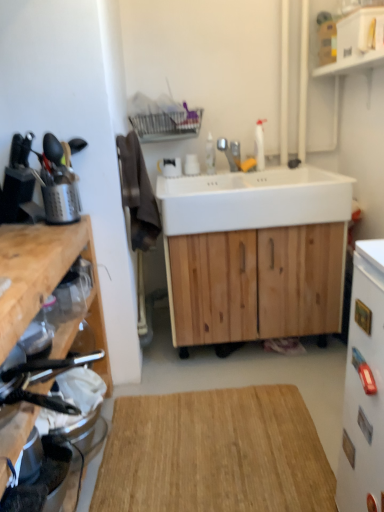
Question: Is natural wood cabinet at center, the 1th cabinetry from the back, at the back of natural wood cutting board at center?

Choices:
 (A) no
 (B) yes

Answer: (B)

Question: Is natural wood cabinet at center, the 1th cabinetry from the back, completely or partially inside natural wood cutting board at center?

Choices:
 (A) no
 (B) yes

Answer: (A)

Question: From the image's perspective, is natural wood cutting board at center above natural wood cabinet at center, which is the 2th cabinetry from front to back?

Choices:
 (A) no
 (B) yes

Answer: (A)

Question: Is natural wood cutting board at center not within natural wood cabinet at center, the 1th cabinetry viewed from the right?

Choices:
 (A) yes
 (B) no

Answer: (A)

Question: Is natural wood cutting board at center further to camera compared to natural wood cabinet at center, the 1th cabinetry viewed from the right?

Choices:
 (A) yes
 (B) no

Answer: (B)

Question: Can you confirm if natural wood cutting board at center is taller than natural wood cabinet at center, which is the 2th cabinetry from front to back?

Choices:
 (A) no
 (B) yes

Answer: (A)

Question: Considering the relative sizes of wooden cutting board at left, placed as the second cabinetry when sorted from right to left, and silver metallic faucet at center in the image provided, is wooden cutting board at left, placed as the second cabinetry when sorted from right to left, smaller than silver metallic faucet at center?

Choices:
 (A) no
 (B) yes

Answer: (A)

Question: Is wooden cutting board at left, placed as the second cabinetry when sorted from right to left, aimed at silver metallic faucet at center?

Choices:
 (A) yes
 (B) no

Answer: (B)

Question: Is wooden cutting board at left, placed as the second cabinetry when sorted from right to left, at the right side of silver metallic faucet at center?

Choices:
 (A) no
 (B) yes

Answer: (A)

Question: Would you say wooden cutting board at left, arranged as the 1th cabinetry when viewed from the front, contains silver metallic faucet at center?

Choices:
 (A) yes
 (B) no

Answer: (B)

Question: Is wooden cutting board at left, arranged as the 1th cabinetry when viewed from the front, located outside silver metallic faucet at center?

Choices:
 (A) no
 (B) yes

Answer: (B)

Question: Does wooden cutting board at left, the second cabinetry viewed from the back, have a lesser width compared to silver metallic faucet at center?

Choices:
 (A) no
 (B) yes

Answer: (A)

Question: Can you confirm if white glossy refrigerator at right, the first appliance positioned from the right, is positioned to the right of metallic silver toaster at left, the second appliance viewed from the right?

Choices:
 (A) yes
 (B) no

Answer: (A)